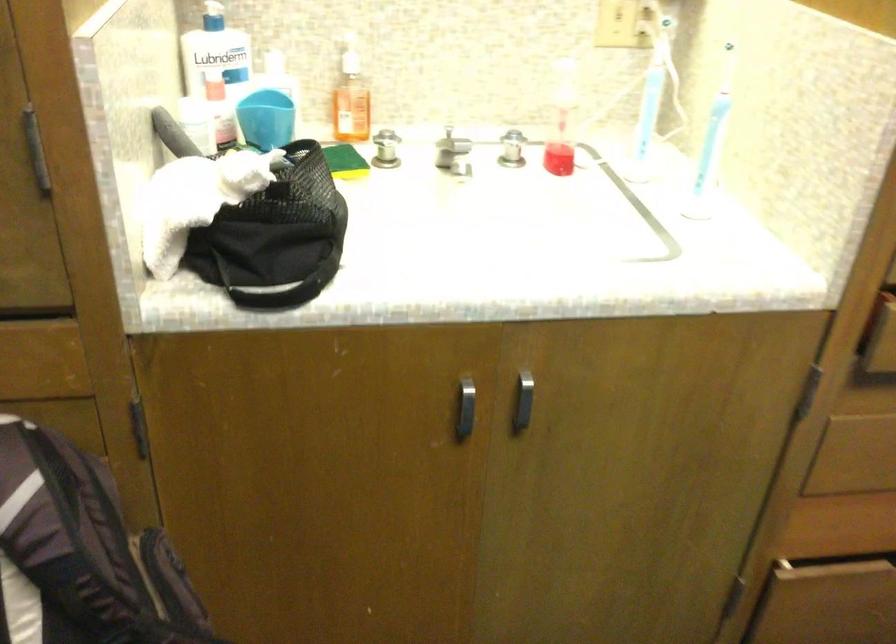
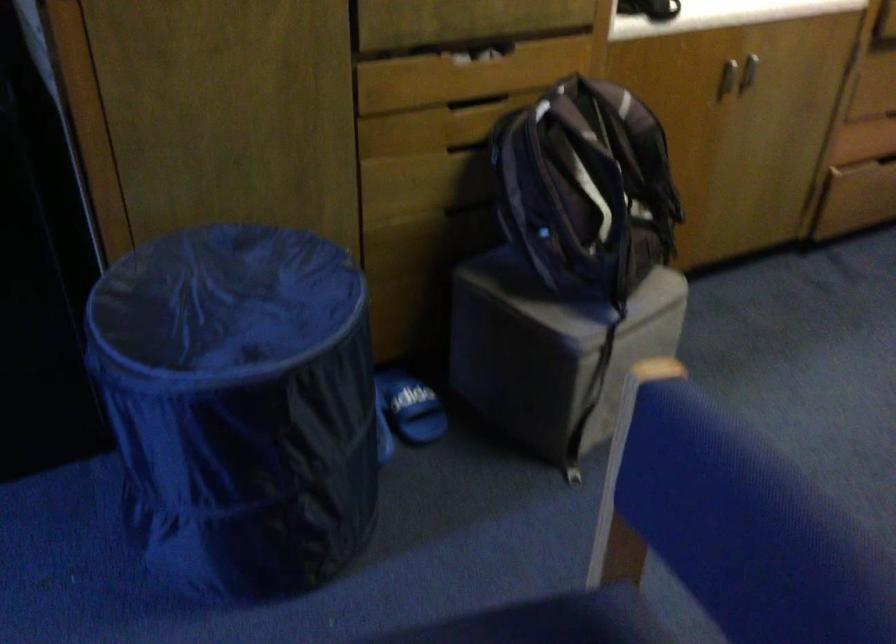
Where in the second image is the point corresponding to point (520, 418) from the first image?

(748, 71)